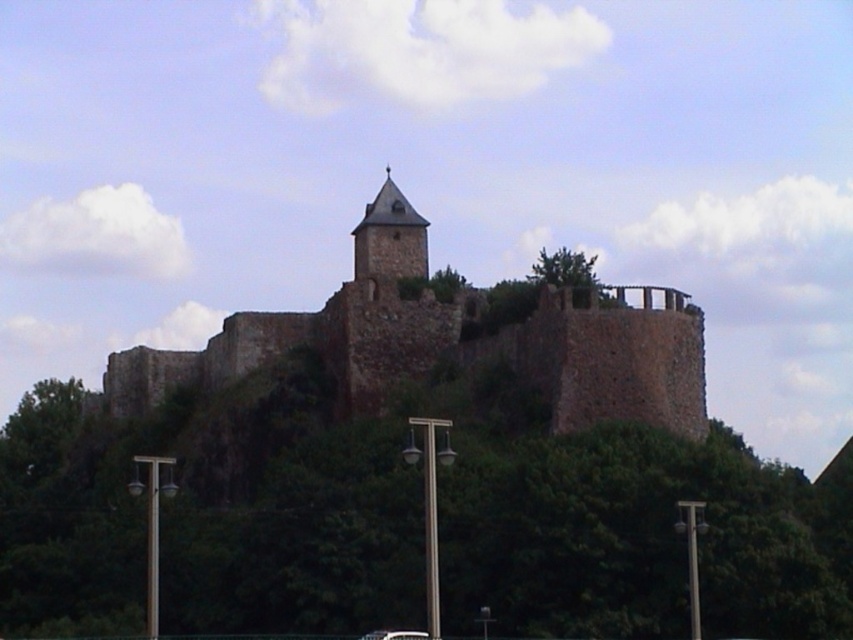
Does rustic stone tower at center have a greater width compared to black glossy car at lower center?

Correct, the width of rustic stone tower at center exceeds that of black glossy car at lower center.

Is point (390, 262) farther from viewer compared to point (392, 628)?

Yes, point (390, 262) is behind point (392, 628).

Is point (374, 232) behind point (398, 630)?

Yes.

Locate an element on the screen. This screenshot has height=640, width=853. rustic stone tower at center is located at coordinates (390, 236).

Based on the photo, does brown stone castle at center appear over rustic stone tower at center?

No, brown stone castle at center is not above rustic stone tower at center.

Does brown stone castle at center have a lesser height compared to rustic stone tower at center?

In fact, brown stone castle at center may be taller than rustic stone tower at center.

Which is in front, point (621, 397) or point (421, 273)?

Point (621, 397) is in front.

Find the location of `brown stone castle at center`. brown stone castle at center is located at coordinates (447, 340).

Does brown stone castle at center have a greater width compared to black glossy car at lower center?

Indeed, brown stone castle at center has a greater width compared to black glossy car at lower center.

Is brown stone castle at center to the left of black glossy car at lower center from the viewer's perspective?

Correct, you'll find brown stone castle at center to the left of black glossy car at lower center.

In order to click on brown stone castle at center in this screenshot , I will do `click(447, 340)`.